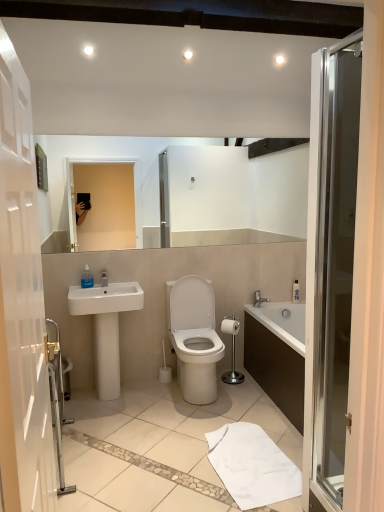
Question: Does transparent glass door at right come behind translucent plastic soap dispenser at sink, which appears as the first toiletry when viewed from the front?

Choices:
 (A) no
 (B) yes

Answer: (A)

Question: Could you tell me if transparent glass door at right is facing translucent plastic soap dispenser at sink, the 2th toiletry in the back-to-front sequence?

Choices:
 (A) no
 (B) yes

Answer: (A)

Question: Is transparent glass door at right looking in the opposite direction of translucent plastic soap dispenser at sink, which is the 1th toiletry from left to right?

Choices:
 (A) yes
 (B) no

Answer: (B)

Question: Is the surface of transparent glass door at right in direct contact with translucent plastic soap dispenser at sink, the 2th toiletry in the back-to-front sequence?

Choices:
 (A) yes
 (B) no

Answer: (B)

Question: Considering the relative positions of transparent glass door at right and translucent plastic soap dispenser at sink, which appears as the first toiletry when viewed from the front, in the image provided, is transparent glass door at right to the right of translucent plastic soap dispenser at sink, which appears as the first toiletry when viewed from the front, from the viewer's perspective?

Choices:
 (A) no
 (B) yes

Answer: (B)

Question: In terms of height, does transparent glass door at right look taller or shorter compared to white plastic bottle at upper right, marked as the 2th toiletry in a front-to-back arrangement?

Choices:
 (A) short
 (B) tall

Answer: (B)

Question: Based on their positions, is transparent glass door at right located to the left or right of white plastic bottle at upper right, which is counted as the first toiletry, starting from the right?

Choices:
 (A) left
 (B) right

Answer: (A)

Question: Considering their positions, is transparent glass door at right located in front of or behind white plastic bottle at upper right, the 1th toiletry in the bottom-to-top sequence?

Choices:
 (A) front
 (B) behind

Answer: (A)

Question: Is transparent glass door at right inside or outside of white plastic bottle at upper right, which is counted as the first toiletry, starting from the right?

Choices:
 (A) outside
 (B) inside

Answer: (A)

Question: Would you say transparent glass door at right is to the left or to the right of white glossy toilet at center in the picture?

Choices:
 (A) right
 (B) left

Answer: (A)

Question: Is transparent glass door at right in front of or behind white glossy toilet at center in the image?

Choices:
 (A) front
 (B) behind

Answer: (A)

Question: Is transparent glass door at right wider or thinner than white glossy toilet at center?

Choices:
 (A) thin
 (B) wide

Answer: (A)

Question: In terms of height, does transparent glass door at right look taller or shorter compared to white glossy toilet at center?

Choices:
 (A) short
 (B) tall

Answer: (B)

Question: Is translucent plastic soap dispenser at sink, the 2th toiletry in the back-to-front sequence, inside or outside of white matte toilet paper at center?

Choices:
 (A) inside
 (B) outside

Answer: (B)

Question: Considering the positions of translucent plastic soap dispenser at sink, the 2th toiletry in the right-to-left sequence, and white matte toilet paper at center in the image, is translucent plastic soap dispenser at sink, the 2th toiletry in the right-to-left sequence, bigger or smaller than white matte toilet paper at center?

Choices:
 (A) small
 (B) big

Answer: (A)